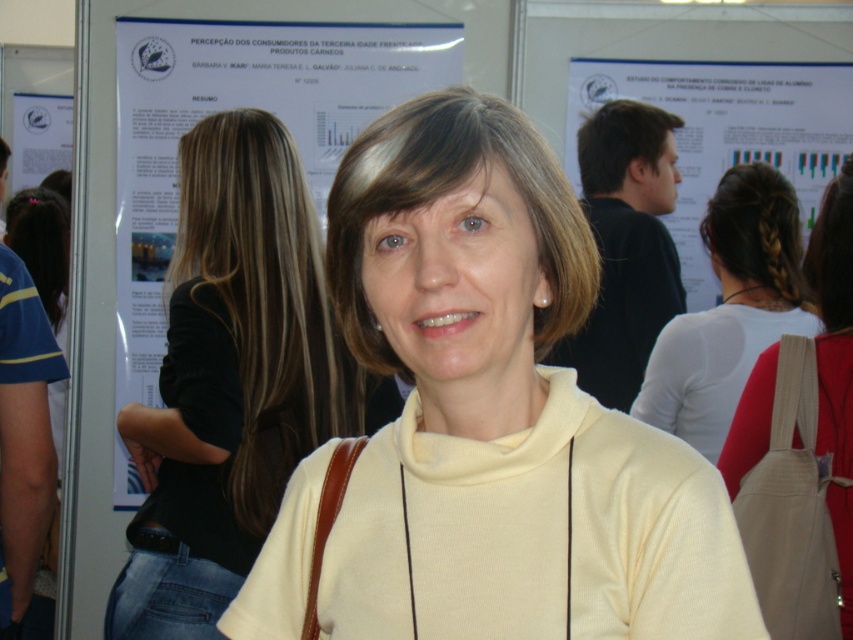
Measure the distance from creamy yellow sweater at center to white paper at upper center.

creamy yellow sweater at center and white paper at upper center are 1.91 meters apart.

Can you confirm if creamy yellow sweater at center is smaller than white paper at upper center?

Incorrect, creamy yellow sweater at center is not smaller in size than white paper at upper center.

Who is more distant from viewer, [335,563] or [706,186]?

Positioned behind is point [706,186].

I want to click on creamy yellow sweater at center, so [500, 412].

Is brown smooth hair at center further to camera compared to white paper at upper center?

No.

Image resolution: width=853 pixels, height=640 pixels. Describe the element at coordinates (445, 193) in the screenshot. I see `brown smooth hair at center` at that location.

Is point (428, 177) positioned after point (741, 74)?

That is False.

The image size is (853, 640). What are the coordinates of `brown smooth hair at center` in the screenshot? It's located at (445, 193).

Who is positioned more to the right, white matte shirt at center or dark brown hair at upper right?

From the viewer's perspective, white matte shirt at center appears more on the right side.

Where is `white matte shirt at center`? The height and width of the screenshot is (640, 853). white matte shirt at center is located at coordinates (730, 308).